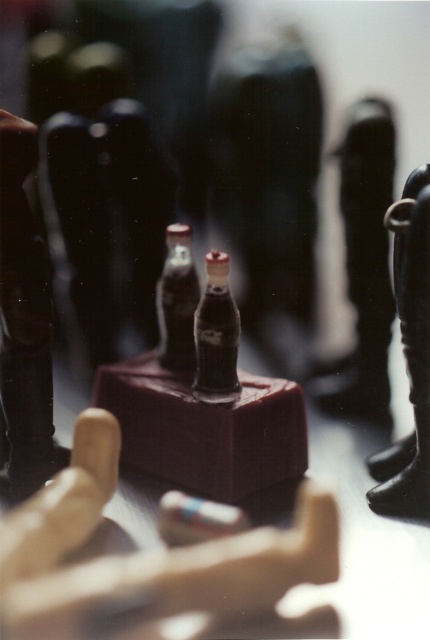
Describe the element at coordinates (408, 355) in the screenshot. The width and height of the screenshot is (430, 640). I see `black rubber boot at right` at that location.

Where is `black rubber boot at right`? The height and width of the screenshot is (640, 430). black rubber boot at right is located at coordinates (408, 355).

Between point (420, 348) and point (208, 324), which one is positioned behind?

The point (208, 324) is behind.

Identify the location of black rubber boot at right. This screenshot has width=430, height=640. (408, 355).

You are a GUI agent. You are given a task and a screenshot of the screen. Output one action in this format:
    pyautogui.click(x=<x>, y=<y>)
    Task: Click on the black rubber boot at right
    This screenshot has width=430, height=640.
    Given the screenshot: What is the action you would take?
    pyautogui.click(x=408, y=355)

Is point (405, 333) farther from viewer compared to point (157, 282)?

No, (405, 333) is in front of (157, 282).

The height and width of the screenshot is (640, 430). Identify the location of black rubber boot at right. (408, 355).

Between shiny plastic bottles at center and shiny dark glass bottle at center, which one appears on the right side from the viewer's perspective?

From the viewer's perspective, shiny dark glass bottle at center appears more on the right side.

Is shiny plastic bottles at center to the left of shiny dark glass bottle at center from the viewer's perspective?

Indeed, shiny plastic bottles at center is positioned on the left side of shiny dark glass bottle at center.

Image resolution: width=430 pixels, height=640 pixels. I want to click on shiny plastic bottles at center, so click(x=202, y=396).

Identify the location of shiny plastic bottles at center. 202,396.